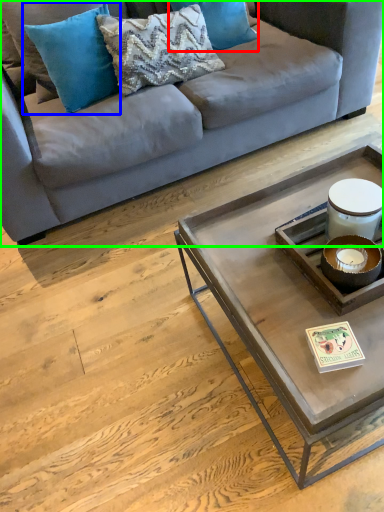
Question: Which is farther away from pillow (highlighted by a red box)? pillow (highlighted by a blue box) or studio couch (highlighted by a green box)?

Choices:
 (A) pillow
 (B) studio couch

Answer: (A)